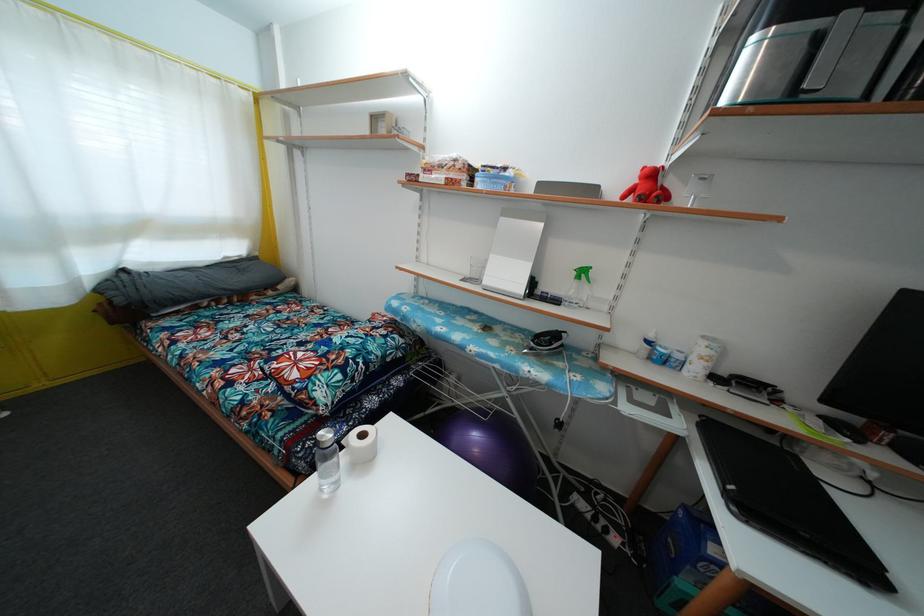
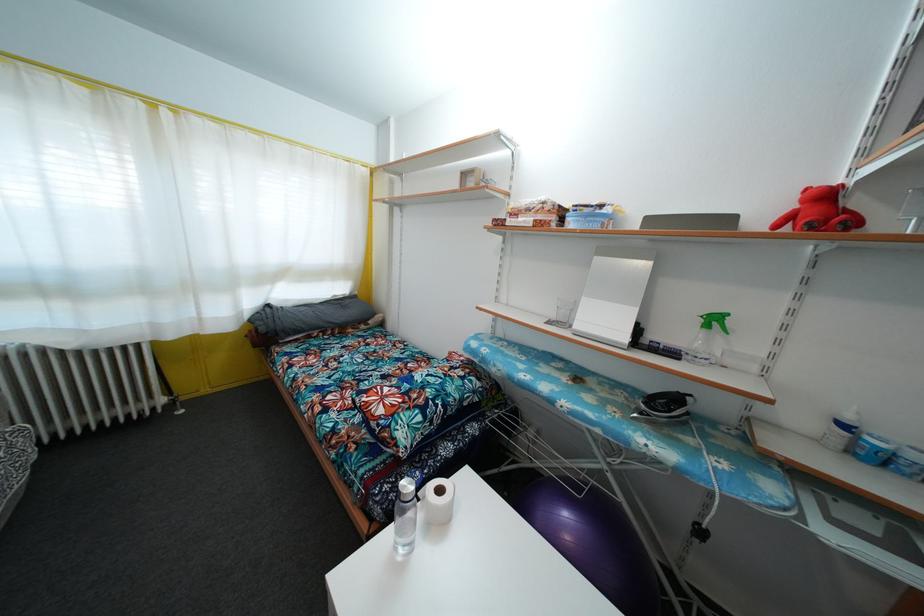
Locate, in the second image, the point that corresponds to the point at 472,282 in the first image.

(556, 323)